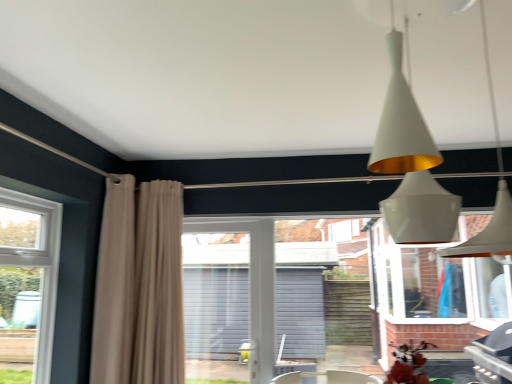
Question: Can you confirm if white matte cone at upper center is wider than brick wall at center?

Choices:
 (A) no
 (B) yes

Answer: (B)

Question: Is white matte cone at upper center at the left side of brick wall at center?

Choices:
 (A) no
 (B) yes

Answer: (B)

Question: From the image's perspective, is white matte cone at upper center located above brick wall at center?

Choices:
 (A) no
 (B) yes

Answer: (B)

Question: Could you tell me if white matte cone at upper center is turned towards brick wall at center?

Choices:
 (A) no
 (B) yes

Answer: (A)

Question: From a real-world perspective, is white matte cone at upper center on brick wall at center?

Choices:
 (A) no
 (B) yes

Answer: (B)

Question: From the image's perspective, is brick wall at center above or below white plastic screen door at center?

Choices:
 (A) below
 (B) above

Answer: (B)

Question: In the image, is brick wall at center on the left side or the right side of white plastic screen door at center?

Choices:
 (A) left
 (B) right

Answer: (B)

Question: In terms of size, does brick wall at center appear bigger or smaller than white plastic screen door at center?

Choices:
 (A) big
 (B) small

Answer: (A)

Question: Is point (364, 339) closer or farther from the camera than point (263, 286)?

Choices:
 (A) farther
 (B) closer

Answer: (A)

Question: From a real-world perspective, is beige fabric curtain at left, positioned as the first curtain in left-to-right order, physically located above or below white matte cone at upper center?

Choices:
 (A) below
 (B) above

Answer: (A)

Question: Looking at their shapes, would you say beige fabric curtain at left, which ranks as the second curtain in right-to-left order, is wider or thinner than white matte cone at upper center?

Choices:
 (A) thin
 (B) wide

Answer: (A)

Question: In terms of height, does beige fabric curtain at left, which ranks as the second curtain in right-to-left order, look taller or shorter compared to white matte cone at upper center?

Choices:
 (A) short
 (B) tall

Answer: (B)

Question: In terms of size, does beige fabric curtain at left, which ranks as the second curtain in right-to-left order, appear bigger or smaller than white matte cone at upper center?

Choices:
 (A) small
 (B) big

Answer: (A)

Question: From a real-world perspective, relative to white plastic screen door at center, is beige fabric curtain at left, which ranks as the second curtain in right-to-left order, vertically above or below?

Choices:
 (A) above
 (B) below

Answer: (A)

Question: Would you say beige fabric curtain at left, positioned as the first curtain in left-to-right order, is inside or outside white plastic screen door at center?

Choices:
 (A) inside
 (B) outside

Answer: (B)